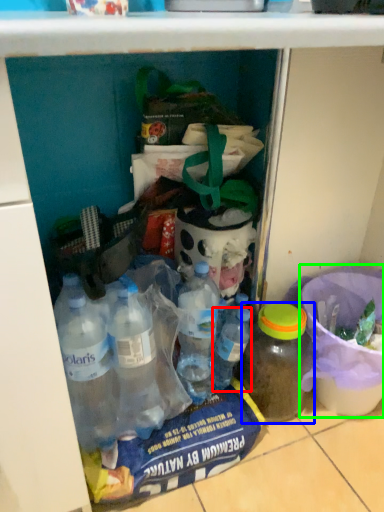
Question: Which object is positioned closest to bottle (highlighted by a red box)? Select from bottle (highlighted by a blue box) and bucket (highlighted by a green box).

Choices:
 (A) bottle
 (B) bucket

Answer: (A)